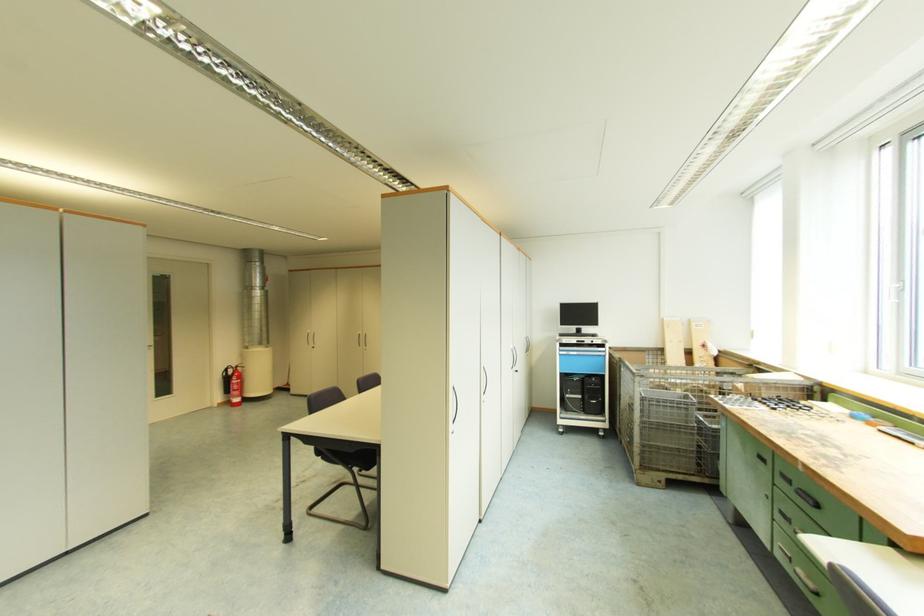
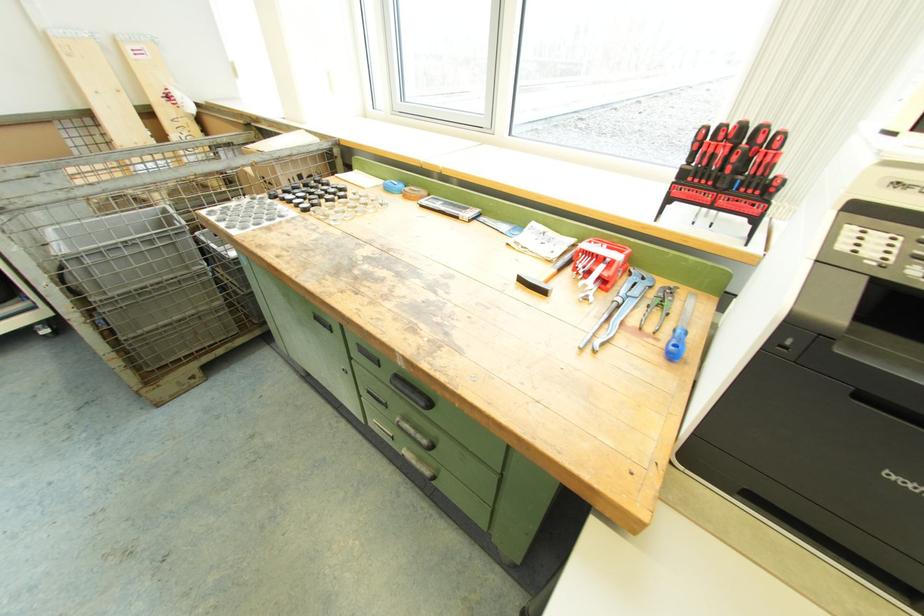
In the second image, find the point that corresponds to (857,416) in the first image.

(391, 188)